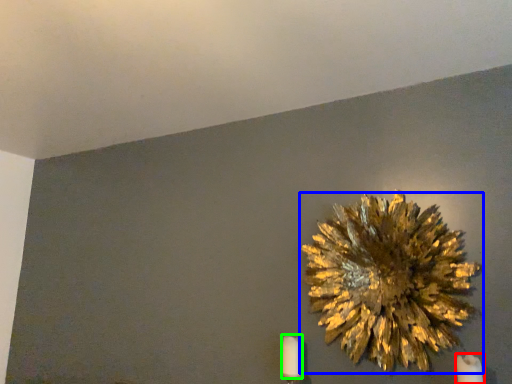
Question: Considering the real-world distances, which object is closest to candle (highlighted by a red box)? flower (highlighted by a blue box) or candle (highlighted by a green box).

Choices:
 (A) flower
 (B) candle

Answer: (A)